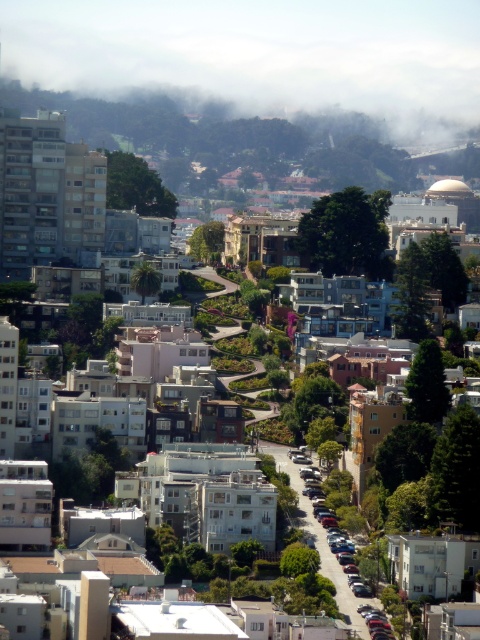
You are a drone operator trying to navigate through the urban area shown in the image. You need to avoid the foggy cloud at upper center. What coordinates should you steer clear of?

The foggy cloud at upper center is located at coordinates point (261, 54), so you should avoid that area to navigate safely.

You are navigating through the urban area shown in the image. You see two points marked on the map at coordinates point (382, 54) and point (290, 477). If you are facing north, which point is closer to you?

Point (382, 54) is behind point (290, 477), so if you are facing north, point (290, 477) is closer to you.